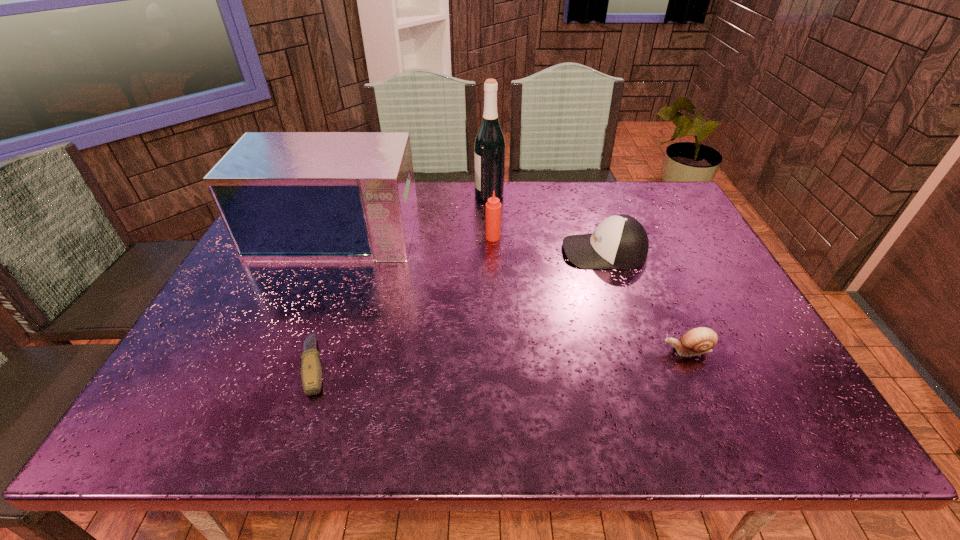
At what (x,y) coordinates should I click in order to perform the action: click on object at the left edge. Please return your answer as a coordinate pair (x, y). Looking at the image, I should click on (282, 196).

Locate an element on the screen. This screenshot has width=960, height=540. object present at the right edge is located at coordinates (697, 341).

You are a GUI agent. You are given a task and a screenshot of the screen. Output one action in this format:
    pyautogui.click(x=<x>, y=<y>)
    Task: Click on the object situated at the far left corner
    This screenshot has width=960, height=540.
    Given the screenshot: What is the action you would take?
    pyautogui.click(x=282, y=196)

The width and height of the screenshot is (960, 540). In the image, there is a desktop. Find the location of `vacant space at the far edge`. vacant space at the far edge is located at coordinates (554, 205).

Identify the location of vacant space at the near edge of the desktop. This screenshot has width=960, height=540. (270, 412).

Find the location of a particular element. vacant space at the left edge of the desktop is located at coordinates (228, 289).

This screenshot has width=960, height=540. In order to click on free space at the right edge of the desktop in this screenshot , I will do `click(705, 297)`.

The height and width of the screenshot is (540, 960). I want to click on vacant position at the far right corner of the desktop, so click(x=667, y=208).

This screenshot has height=540, width=960. I want to click on free point between the microwave oven and the Tabasco sauce, so click(416, 232).

I want to click on free point between the pocketknife and the wine bottle, so click(402, 280).